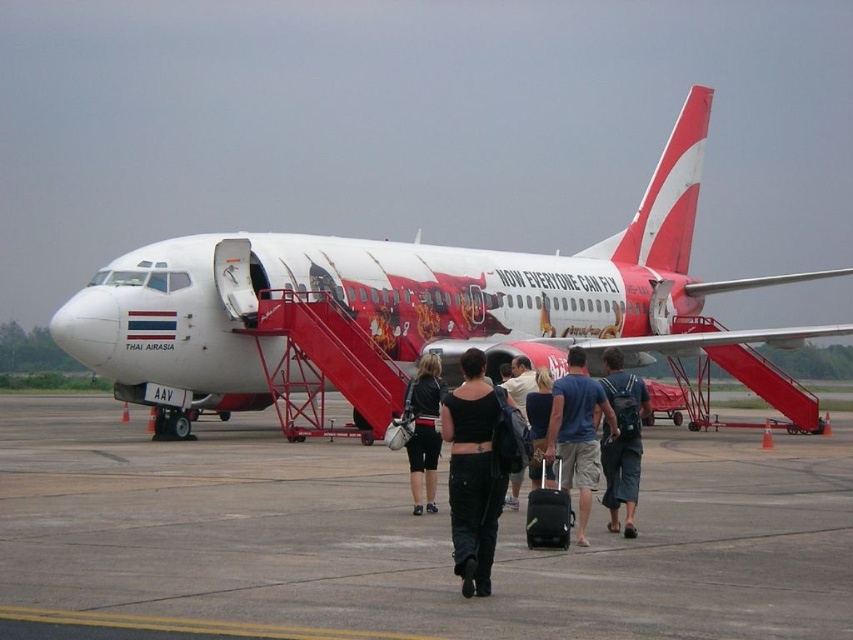
Question: Is matte blue t-shirt at center bigger than dark blue jeans at center?

Choices:
 (A) no
 (B) yes

Answer: (A)

Question: Is black fabric suitcase at center further to the viewer compared to dark blue jeans at center?

Choices:
 (A) yes
 (B) no

Answer: (A)

Question: Is black cotton tank top at center bigger than denim shorts at center?

Choices:
 (A) no
 (B) yes

Answer: (B)

Question: Among these points, which one is nearest to the camera?

Choices:
 (A) (442, 515)
 (B) (439, 380)
 (C) (636, 381)
 (D) (543, 456)

Answer: (D)

Question: Which point is farther from the camera taking this photo?

Choices:
 (A) (341, 244)
 (B) (546, 420)

Answer: (A)

Question: Estimate the real-world distances between objects in this image. Which object is closer to the concrete tarmac at center?

Choices:
 (A) matte black tank top at center
 (B) black cotton tank top at center

Answer: (A)